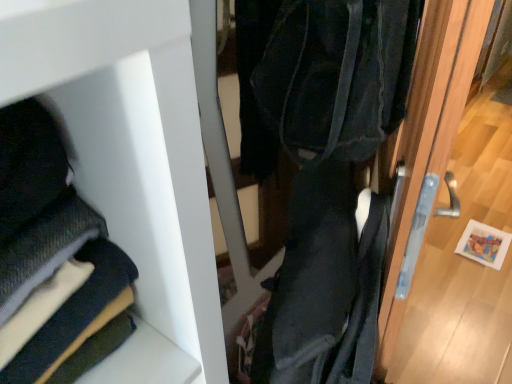
The width and height of the screenshot is (512, 384). Describe the element at coordinates (448, 204) in the screenshot. I see `wooden door handle at right` at that location.

What is the approximate width of wooden door handle at right?

wooden door handle at right is 8.73 inches wide.

Find the location of `wooden door handle at right`. wooden door handle at right is located at coordinates (448, 204).

The height and width of the screenshot is (384, 512). What do you see at coordinates (53, 259) in the screenshot?
I see `dark blue fabric at lower left` at bounding box center [53, 259].

You are a GUI agent. You are given a task and a screenshot of the screen. Output one action in this format:
    pyautogui.click(x=<x>, y=<y>)
    Task: Click on the dark blue fabric at lower left
    The height and width of the screenshot is (384, 512).
    Given the screenshot: What is the action you would take?
    pos(53,259)

In order to click on wooden door handle at right in this screenshot , I will do `click(448, 204)`.

Based on their positions, is dark blue fabric at lower left located to the left or right of wooden door handle at right?

Clearly, dark blue fabric at lower left is on the left of wooden door handle at right in the image.

Between dark blue fabric at lower left and wooden door handle at right, which one is positioned behind?

wooden door handle at right is more distant.

Which point is more forward, (x=28, y=100) or (x=470, y=158)?

The point (x=28, y=100) is closer.

From the image's perspective, is dark blue fabric at lower left located above wooden door handle at right?

Indeed, from the image's perspective, dark blue fabric at lower left is shown above wooden door handle at right.

From a real-world perspective, is dark blue fabric at lower left located higher than wooden door handle at right?

Indeed, from a real-world perspective, dark blue fabric at lower left stands above wooden door handle at right.

Which of these two, dark blue fabric at lower left or wooden door handle at right, is wider?

dark blue fabric at lower left is wider.

Is dark blue fabric at lower left shorter than wooden door handle at right?

Yes.

Can you confirm if dark blue fabric at lower left is smaller than wooden door handle at right?

Yes, dark blue fabric at lower left is smaller than wooden door handle at right.

Would you say dark blue fabric at lower left is outside wooden door handle at right?

Indeed, dark blue fabric at lower left is completely outside wooden door handle at right.

Would you consider dark blue fabric at lower left to be distant from wooden door handle at right?

Absolutely, dark blue fabric at lower left is distant from wooden door handle at right.

Is dark blue fabric at lower left oriented away from wooden door handle at right?

A: dark blue fabric at lower left does not have its back to wooden door handle at right.

Find the location of a particular element. Image resolution: width=512 pixels, height=384 pixels. cloak on the left of wooden door handle at right is located at coordinates (53, 259).

Between wooden door handle at right and dark blue fabric at lower left, which one appears on the left side from the viewer's perspective?

dark blue fabric at lower left.

Considering the positions of objects wooden door handle at right and dark blue fabric at lower left in the image provided, who is behind, wooden door handle at right or dark blue fabric at lower left?

wooden door handle at right is behind.

Is point (474, 126) farther from camera compared to point (17, 375)?

Yes, point (474, 126) is farther from viewer.

From the image's perspective, which is above, wooden door handle at right or dark blue fabric at lower left?

dark blue fabric at lower left is shown above in the image.

From a real-world perspective, is wooden door handle at right located beneath dark blue fabric at lower left?

Correct, in the physical world, wooden door handle at right is lower than dark blue fabric at lower left.

Which of these two, wooden door handle at right or dark blue fabric at lower left, is thinner?

wooden door handle at right.

Can you confirm if wooden door handle at right is taller than dark blue fabric at lower left?

Yes.

Between wooden door handle at right and dark blue fabric at lower left, which one has smaller size?

dark blue fabric at lower left.

Is dark blue fabric at lower left completely or partially inside wooden door handle at right?

No, dark blue fabric at lower left is not a part of wooden door handle at right.

Is wooden door handle at right with dark blue fabric at lower left?

No, wooden door handle at right is not next to dark blue fabric at lower left.

Is wooden door handle at right turned away from dark blue fabric at lower left?

No, wooden door handle at right is not facing the opposite direction of dark blue fabric at lower left.

How many degrees apart are the facing directions of wooden door handle at right and dark blue fabric at lower left?

90.8 degrees.

Find the location of a particular element. cloak on the left of the wooden door handle at right is located at coordinates (53, 259).

This screenshot has height=384, width=512. Identify the location of cloak that is above the wooden door handle at right (from the image's perspective). (53, 259).

I want to click on door that is behind the dark blue fabric at lower left, so click(448, 204).